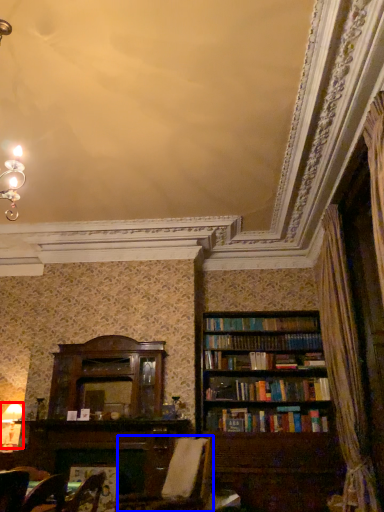
Question: Which of the following is the closest to the observer, lamp (highlighted by a red box) or swivel chair (highlighted by a blue box)?

Choices:
 (A) lamp
 (B) swivel chair

Answer: (B)